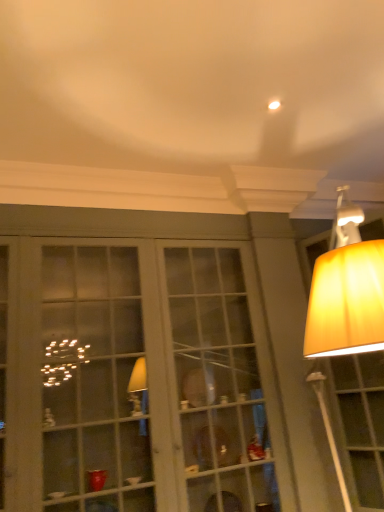
Question: Is white glass cabinet at center not close to matte yellow lampshade at upper right?

Choices:
 (A) yes
 (B) no

Answer: (A)

Question: Does white glass cabinet at center lie in front of matte yellow lampshade at upper right?

Choices:
 (A) yes
 (B) no

Answer: (A)

Question: Is white glass cabinet at center thinner than matte yellow lampshade at upper right?

Choices:
 (A) no
 (B) yes

Answer: (A)

Question: Considering the relative positions of white glass cabinet at center and matte yellow lampshade at upper right in the image provided, is white glass cabinet at center to the left of matte yellow lampshade at upper right from the viewer's perspective?

Choices:
 (A) no
 (B) yes

Answer: (B)

Question: Is white glass cabinet at center facing away from matte yellow lampshade at upper right?

Choices:
 (A) yes
 (B) no

Answer: (B)

Question: Is white glass cabinet at center facing towards matte yellow lampshade at upper right?

Choices:
 (A) no
 (B) yes

Answer: (A)

Question: Can you confirm if matte yellow lampshade at upper right is bigger than white glass cabinet at center?

Choices:
 (A) no
 (B) yes

Answer: (A)

Question: Considering the relative sizes of matte yellow lampshade at upper right and white glass cabinet at center in the image provided, is matte yellow lampshade at upper right wider than white glass cabinet at center?

Choices:
 (A) no
 (B) yes

Answer: (A)

Question: From a real-world perspective, is matte yellow lampshade at upper right positioned under white glass cabinet at center based on gravity?

Choices:
 (A) no
 (B) yes

Answer: (B)

Question: Would you say matte yellow lampshade at upper right is outside white glass cabinet at center?

Choices:
 (A) no
 (B) yes

Answer: (B)

Question: Is matte yellow lampshade at upper right in front of white glass cabinet at center?

Choices:
 (A) no
 (B) yes

Answer: (A)

Question: Does matte yellow lampshade at upper right have a lesser width compared to white glass cabinet at center?

Choices:
 (A) no
 (B) yes

Answer: (B)

Question: Do you think white glass cabinet at center is within matte yellow lampshade at upper right, or outside of it?

Choices:
 (A) inside
 (B) outside

Answer: (B)